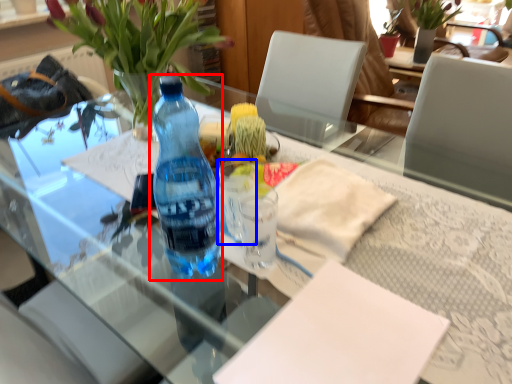
Question: Which point is further to the camera, bottle (highlighted by a red box) or coffee cup (highlighted by a blue box)?

Choices:
 (A) bottle
 (B) coffee cup

Answer: (B)